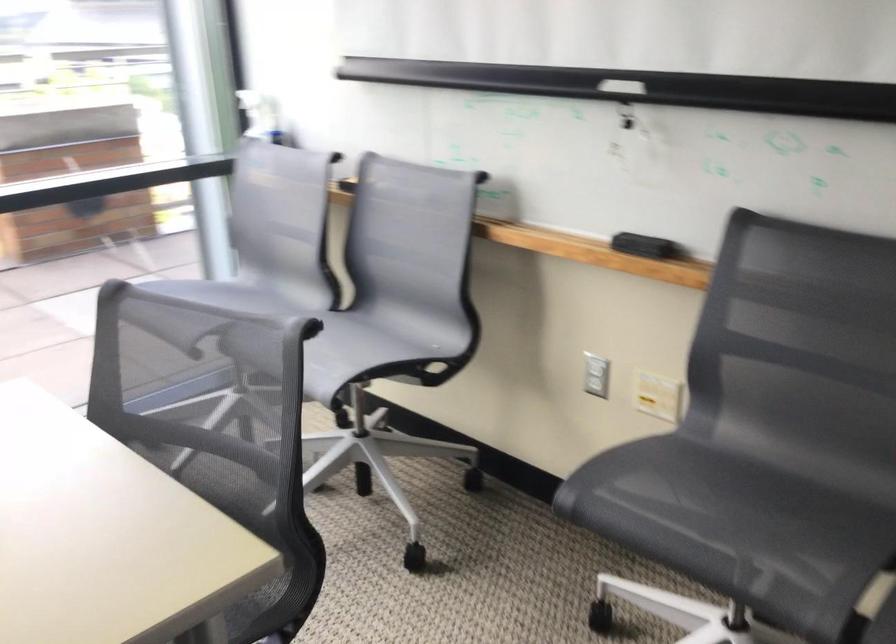
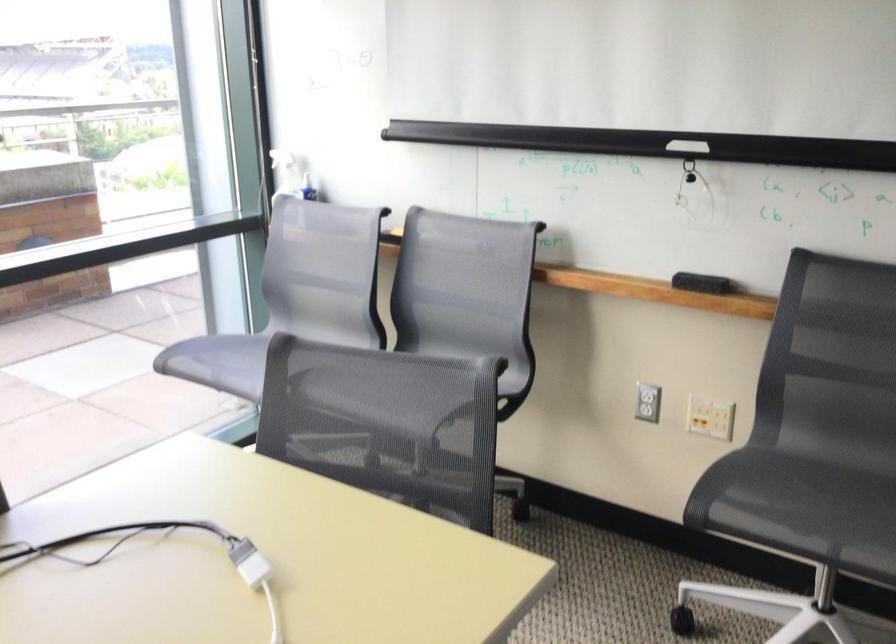
Locate, in the second image, the point that corresponds to the point at 254,115 in the first image.

(287, 174)